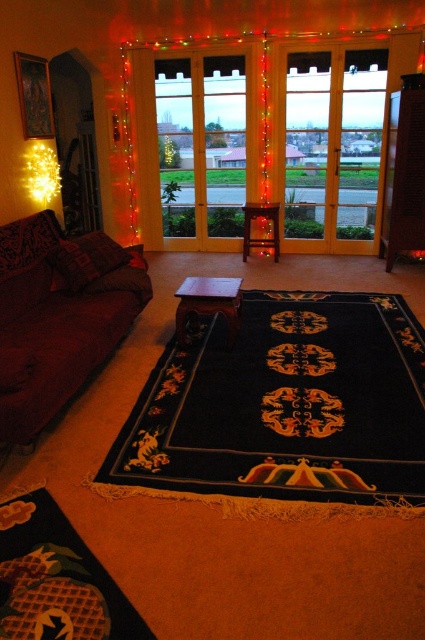
Question: Does velvet dark red couch at left have a lesser width compared to clear glass window at center?

Choices:
 (A) no
 (B) yes

Answer: (B)

Question: Can you confirm if velvet dark red couch at left is bigger than transparent glass door at center?

Choices:
 (A) yes
 (B) no

Answer: (A)

Question: Which object is the closest to the clear glass window at center?

Choices:
 (A) velvet dark red couch at left
 (B) yellow string lights at upper left

Answer: (B)

Question: Where is velvet dark red couch at left located in relation to clear glass window at center in the image?

Choices:
 (A) above
 (B) below

Answer: (B)

Question: Which point is closer to the camera?

Choices:
 (A) velvet dark red couch at left
 (B) clear glass window at center

Answer: (A)

Question: Which object is positioned closest to the velvet dark red couch at left?

Choices:
 (A) yellow string lights at upper left
 (B) transparent glass door at center

Answer: (A)